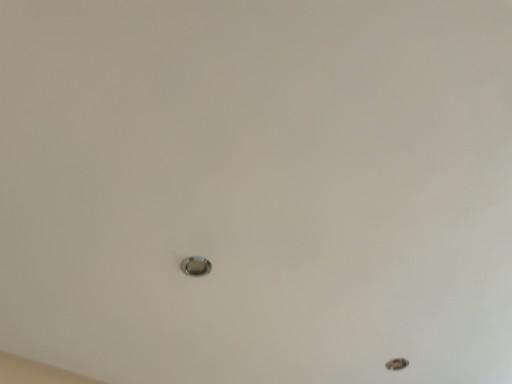
Question: Should I look upward or downward to see metallic circular hole at lower right?

Choices:
 (A) down
 (B) up

Answer: (A)

Question: Should I look upward or downward to see satin silver knob at center?

Choices:
 (A) down
 (B) up

Answer: (A)

Question: Considering the relative sizes of metallic circular hole at lower right and satin silver knob at center in the image provided, is metallic circular hole at lower right smaller than satin silver knob at center?

Choices:
 (A) yes
 (B) no

Answer: (B)

Question: Can satin silver knob at center be found inside metallic circular hole at lower right?

Choices:
 (A) yes
 (B) no

Answer: (B)

Question: Does metallic circular hole at lower right have a lesser width compared to satin silver knob at center?

Choices:
 (A) yes
 (B) no

Answer: (B)

Question: Is metallic circular hole at lower right bigger than satin silver knob at center?

Choices:
 (A) no
 (B) yes

Answer: (B)

Question: From a real-world perspective, is metallic circular hole at lower right located higher than satin silver knob at center?

Choices:
 (A) no
 (B) yes

Answer: (B)

Question: Is metallic circular hole at lower right outside of satin silver knob at center?

Choices:
 (A) yes
 (B) no

Answer: (A)

Question: Is satin silver knob at center taller than metallic circular hole at lower right?

Choices:
 (A) yes
 (B) no

Answer: (B)

Question: Can you confirm if satin silver knob at center is positioned to the right of metallic circular hole at lower right?

Choices:
 (A) yes
 (B) no

Answer: (B)

Question: Is satin silver knob at center turned away from metallic circular hole at lower right?

Choices:
 (A) yes
 (B) no

Answer: (B)

Question: Considering the relative sizes of satin silver knob at center and metallic circular hole at lower right in the image provided, is satin silver knob at center wider than metallic circular hole at lower right?

Choices:
 (A) no
 (B) yes

Answer: (A)

Question: Are satin silver knob at center and metallic circular hole at lower right making contact?

Choices:
 (A) yes
 (B) no

Answer: (B)

Question: From a real-world perspective, is satin silver knob at center on top of metallic circular hole at lower right?

Choices:
 (A) yes
 (B) no

Answer: (B)

Question: From a real-world perspective, relative to metallic circular hole at lower right, is satin silver knob at center vertically above or below?

Choices:
 (A) below
 (B) above

Answer: (A)